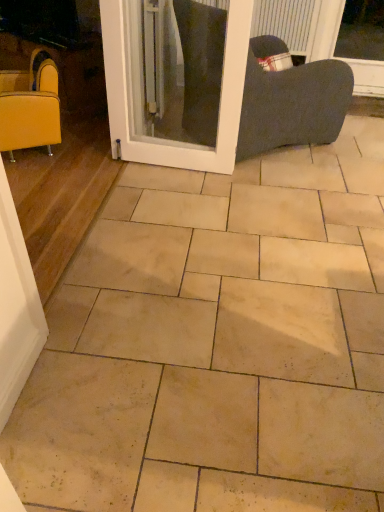
Question: Considering the positions of white glossy screen door at center and matte yellow armchair at left in the image, is white glossy screen door at center taller or shorter than matte yellow armchair at left?

Choices:
 (A) short
 (B) tall

Answer: (B)

Question: Is white glossy screen door at center spatially inside matte yellow armchair at left, or outside of it?

Choices:
 (A) inside
 (B) outside

Answer: (B)

Question: From a real-world perspective, is white glossy screen door at center physically located above or below matte yellow armchair at left?

Choices:
 (A) above
 (B) below

Answer: (A)

Question: In the image, is matte yellow armchair at left positioned in front of or behind white glossy screen door at center?

Choices:
 (A) behind
 (B) front

Answer: (A)

Question: Looking at the image, does matte yellow armchair at left seem bigger or smaller compared to white glossy screen door at center?

Choices:
 (A) small
 (B) big

Answer: (B)

Question: Is matte yellow armchair at left wider or thinner than white glossy screen door at center?

Choices:
 (A) thin
 (B) wide

Answer: (B)

Question: From the image's perspective, is matte yellow armchair at left located above or below white glossy screen door at center?

Choices:
 (A) below
 (B) above

Answer: (A)